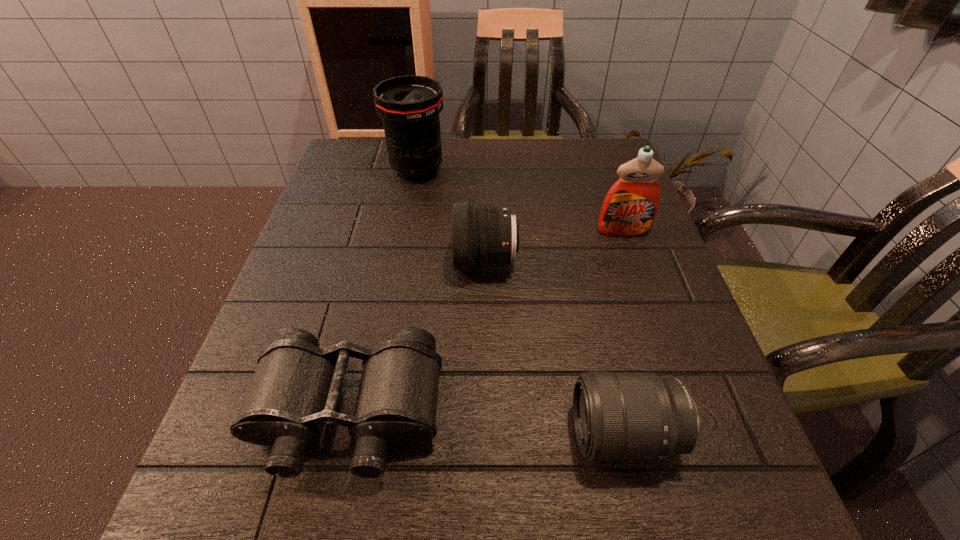
Locate an element on the screen. The height and width of the screenshot is (540, 960). free location located 0.150m at the front element of the third object from right to left is located at coordinates (382, 262).

Where is `free space located at the front element of the third object from right to left`? free space located at the front element of the third object from right to left is located at coordinates point(425,262).

At what (x,y) coordinates should I click in order to perform the action: click on vacant space located on the surface of the rightmost telephoto lens. Please return your answer as a coordinate pair (x, y). Image resolution: width=960 pixels, height=540 pixels. Looking at the image, I should click on (540, 435).

Find the location of a particular element. vacant space situated 0.250m on the surface of the rightmost telephoto lens is located at coordinates (403, 435).

Identify the location of vacant space situated 0.310m on the surface of the rightmost telephoto lens. (362, 435).

Identify the location of object that is at the far edge. This screenshot has height=540, width=960. (409, 106).

The height and width of the screenshot is (540, 960). Find the location of `object present at the near edge`. object present at the near edge is located at coordinates pos(295,389).

What are the coordinates of `telephoto lens present at the left edge` in the screenshot? It's located at (409, 106).

Find the location of a particular element. The height and width of the screenshot is (540, 960). binoculars present at the left edge is located at coordinates (295, 389).

You are a GUI agent. You are given a task and a screenshot of the screen. Output one action in this format:
    pyautogui.click(x=<x>, y=<y>)
    Task: Click on the detergent at the right edge
    
    Given the screenshot: What is the action you would take?
    pyautogui.click(x=629, y=209)